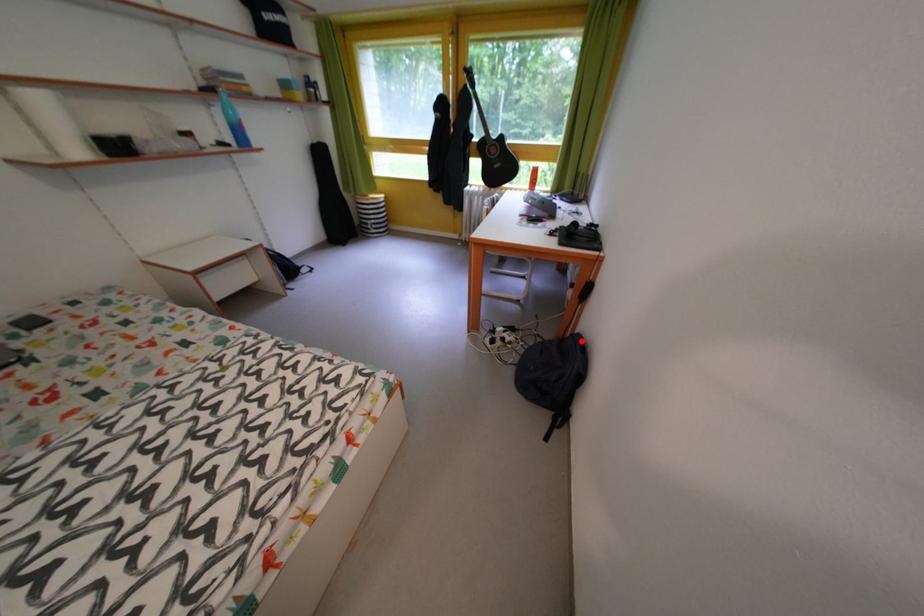
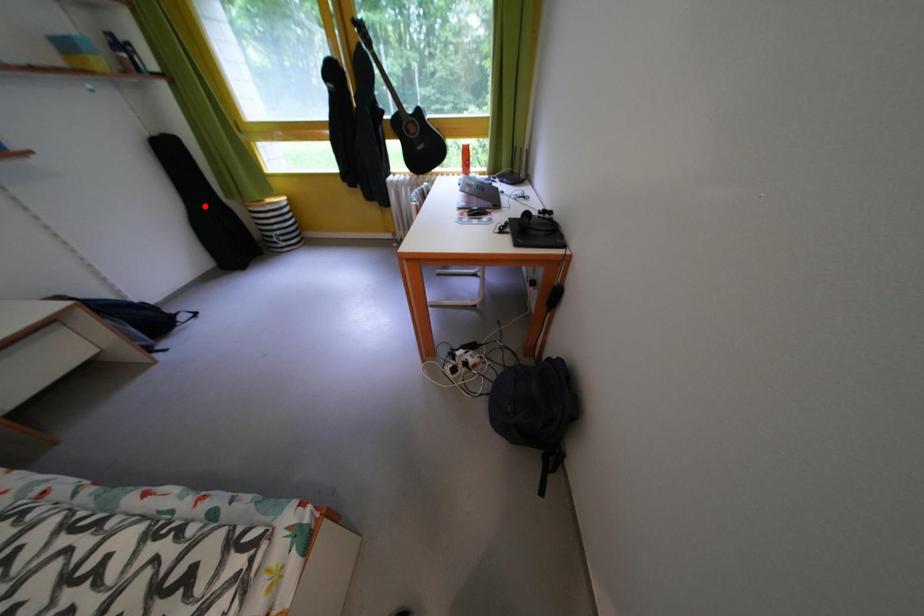
I am providing you with two images of the same scene from different viewpoints. A red point is marked on the first image and another point is marked on the second image. Is the marked point in image1 the same physical position as the marked point in image2?

No